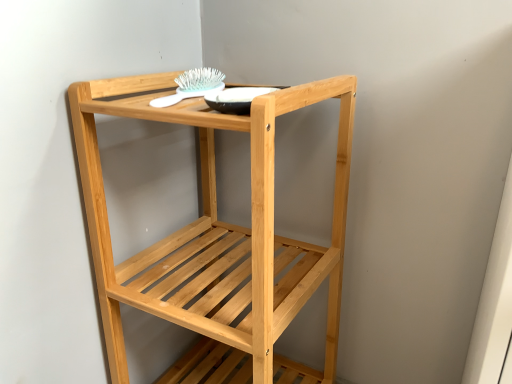
Question: From a real-world perspective, is natural wood shelf at center positioned above or below white plastic brush at upper center?

Choices:
 (A) above
 (B) below

Answer: (B)

Question: In the image, is natural wood shelf at center positioned in front of or behind white plastic brush at upper center?

Choices:
 (A) behind
 (B) front

Answer: (B)

Question: Which is farther from the matte black bowl at upper center?

Choices:
 (A) white plastic brush at upper center
 (B) natural wood shelf at center

Answer: (B)

Question: Which is farther from the natural wood shelf at center?

Choices:
 (A) white plastic brush at upper center
 (B) matte black bowl at upper center

Answer: (A)